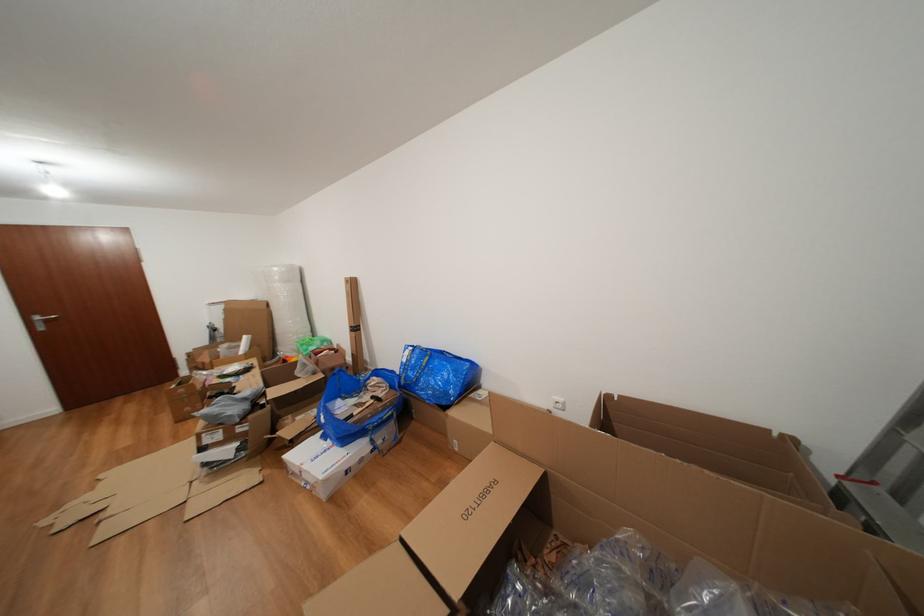
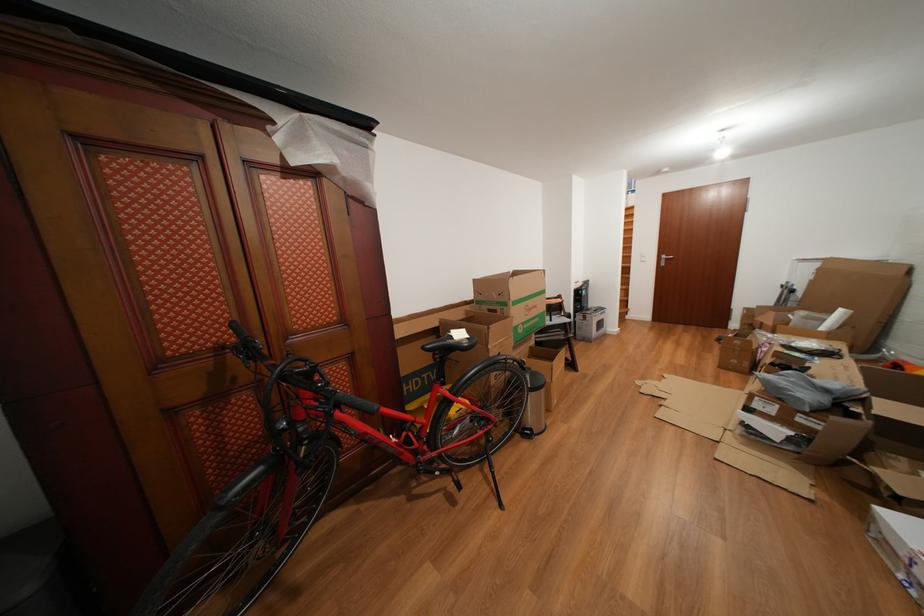
Where in the second image is the point corresponding to the point at 235,326 from the first image?

(821, 288)